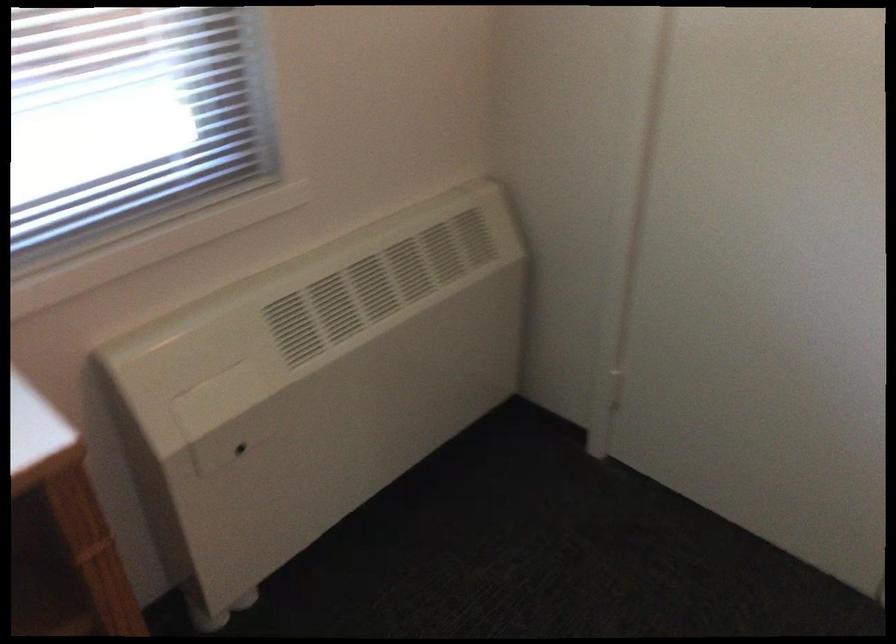
Where would you turn the heater control dial? Please return your answer as a coordinate pair (x, y).

(237, 444)